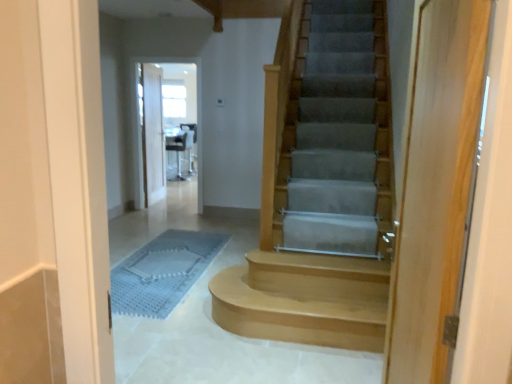
Question: Is white glossy chair at upper center to the right of light wood door at right, which appears as the second door when viewed from the back, from the viewer's perspective?

Choices:
 (A) yes
 (B) no

Answer: (B)

Question: Is white glossy chair at upper center outside light wood door at right, placed as the first door when sorted from right to left?

Choices:
 (A) yes
 (B) no

Answer: (A)

Question: Would you say light wood door at right, the 2th door when ordered from left to right, is part of white glossy chair at upper center's contents?

Choices:
 (A) no
 (B) yes

Answer: (A)

Question: Can you confirm if white glossy chair at upper center is bigger than light wood door at right, placed as the first door when sorted from right to left?

Choices:
 (A) no
 (B) yes

Answer: (B)

Question: Does white glossy chair at upper center have a smaller size compared to light wood door at right, which is the first door in front-to-back order?

Choices:
 (A) no
 (B) yes

Answer: (A)

Question: Is white glossy chair at upper center behind light wood door at right, which appears as the second door when viewed from the back?

Choices:
 (A) no
 (B) yes

Answer: (B)

Question: Does clear glass screen door at center have a lesser width compared to white wood door at upper center, the first door positioned from the left?

Choices:
 (A) yes
 (B) no

Answer: (B)

Question: Can you confirm if clear glass screen door at center is taller than white wood door at upper center, which is the second door in front-to-back order?

Choices:
 (A) no
 (B) yes

Answer: (B)

Question: Is the depth of clear glass screen door at center greater than that of white wood door at upper center, the 1th door positioned from the back?

Choices:
 (A) yes
 (B) no

Answer: (B)

Question: Is clear glass screen door at center shorter than white wood door at upper center, the 1th door positioned from the back?

Choices:
 (A) yes
 (B) no

Answer: (B)

Question: Is clear glass screen door at center outside of white wood door at upper center, the 1th door positioned from the back?

Choices:
 (A) no
 (B) yes

Answer: (B)

Question: Considering the relative sizes of clear glass screen door at center and white wood door at upper center, which is the second door in front-to-back order, in the image provided, is clear glass screen door at center smaller than white wood door at upper center, which is the second door in front-to-back order,?

Choices:
 (A) yes
 (B) no

Answer: (B)

Question: Is white wood door at upper center, the 2th door in the right-to-left sequence, at the left side of clear glass screen door at center?

Choices:
 (A) no
 (B) yes

Answer: (B)